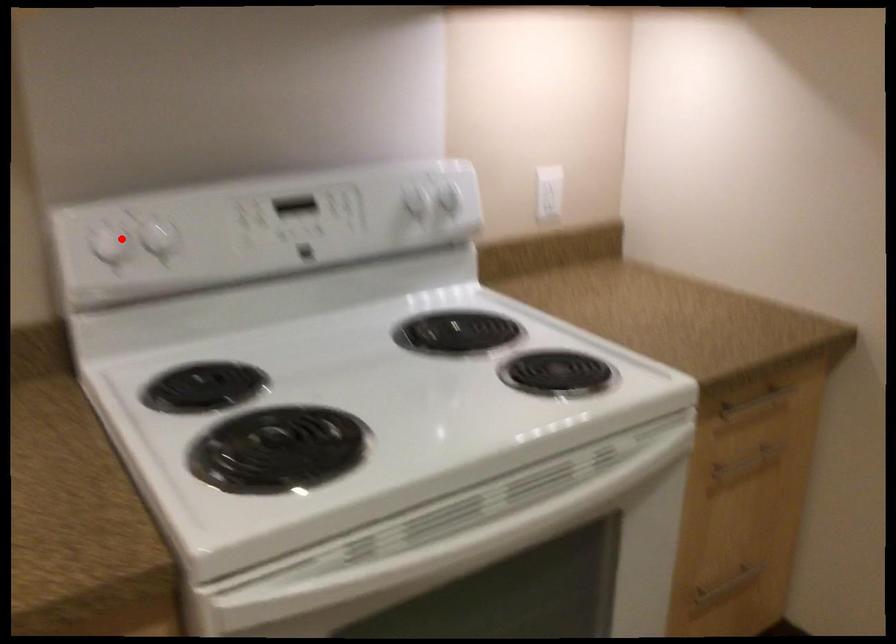
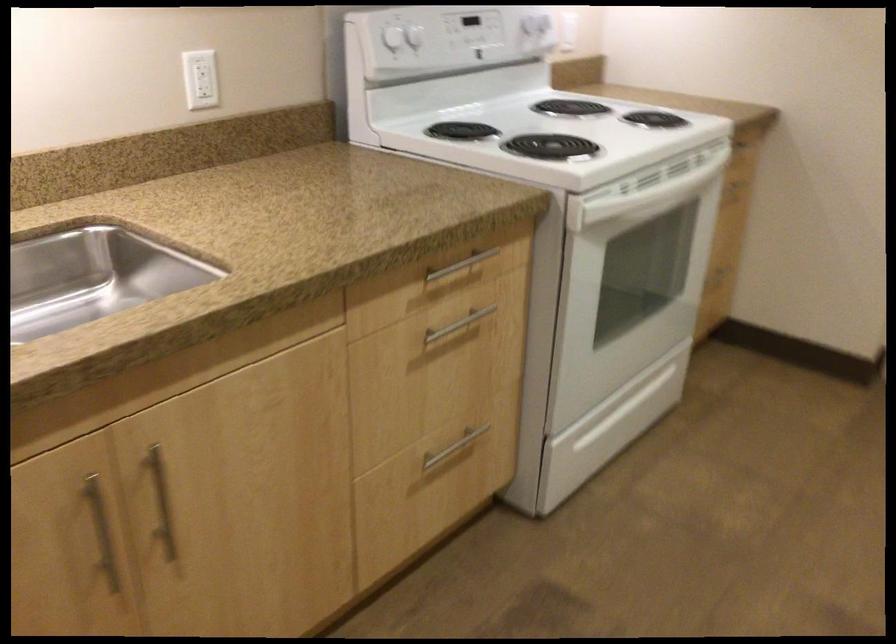
Question: I am providing you with two images of the same scene from different viewpoints. Given a red point in image1, look at the same physical point in image2. Is it:

Choices:
 (A) Closer to the viewpoint
 (B) Farther from the viewpoint

Answer: (B)